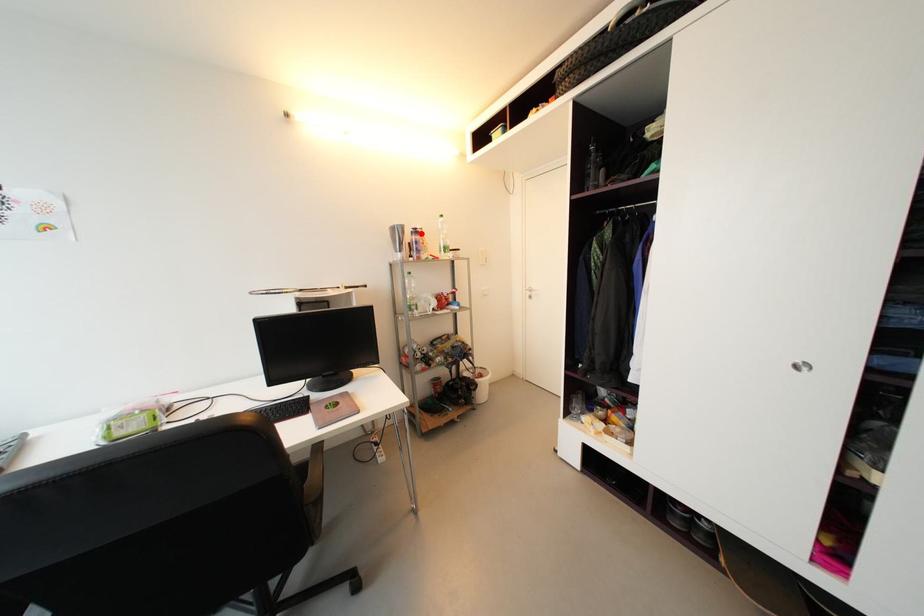
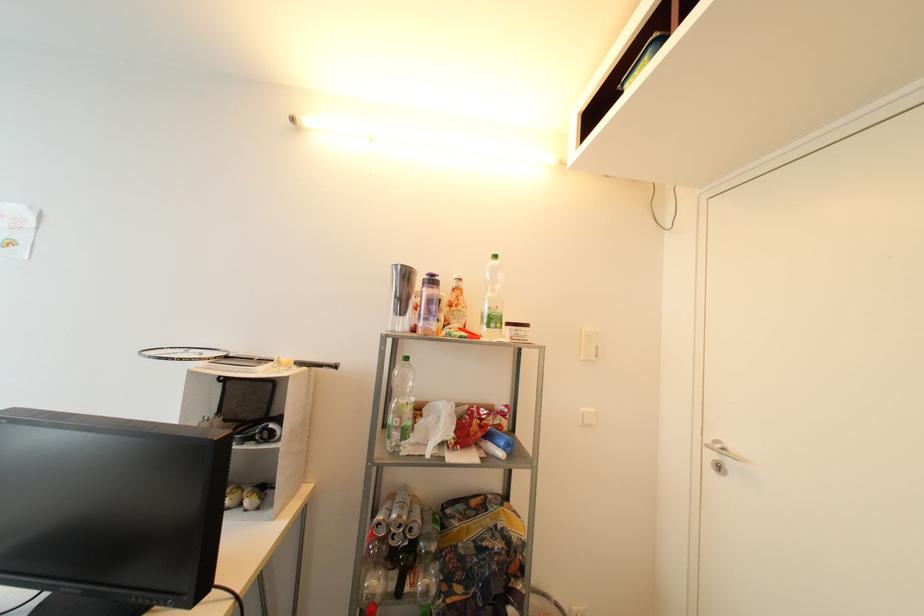
In the second image, find the point that corresponds to the highlighted location in the first image.

(438, 283)